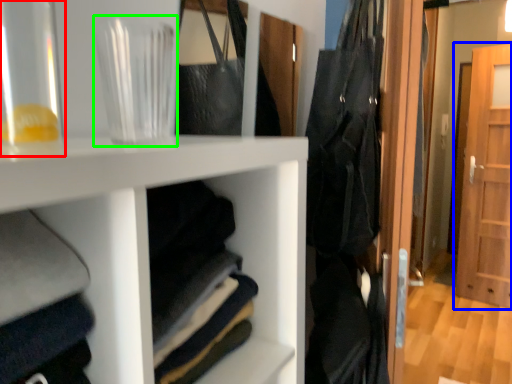
Question: Considering the real-world distances, which object is closest to glass vase (highlighted by a red box)? door (highlighted by a blue box) or glass vase (highlighted by a green box).

Choices:
 (A) door
 (B) glass vase

Answer: (B)